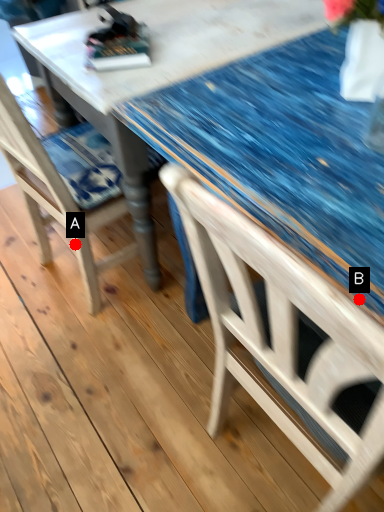
Question: Two points are circled on the image, labeled by A and B beside each circle. Which point appears farthest from the camera in this image?

Choices:
 (A) A is further
 (B) B is further

Answer: (A)